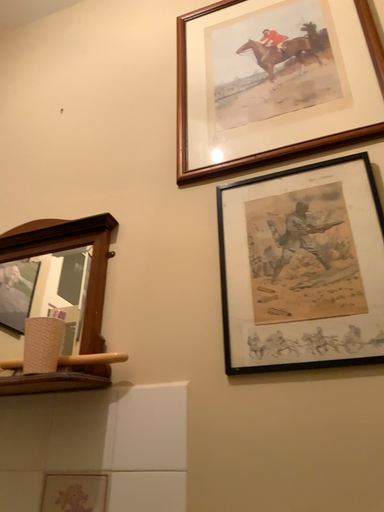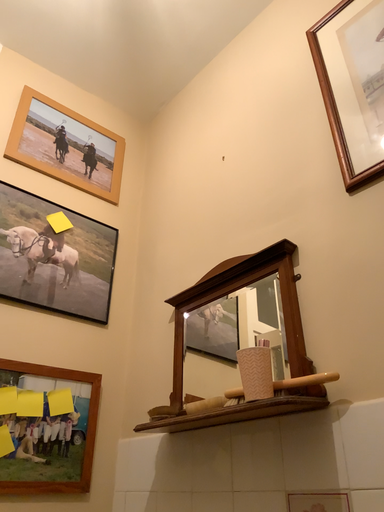
Question: How did the camera likely rotate when shooting the video?

Choices:
 (A) rotated left
 (B) rotated right

Answer: (A)